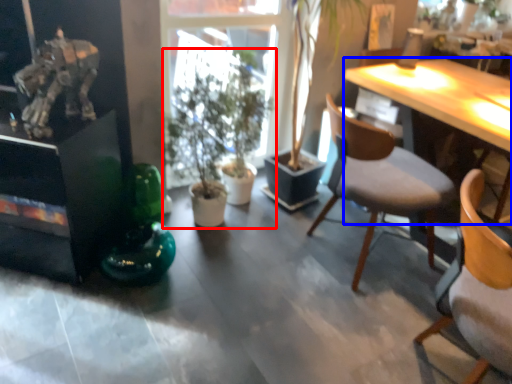
Question: Which object is further to the camera taking this photo, houseplant (highlighted by a red box) or desk (highlighted by a blue box)?

Choices:
 (A) houseplant
 (B) desk

Answer: (B)